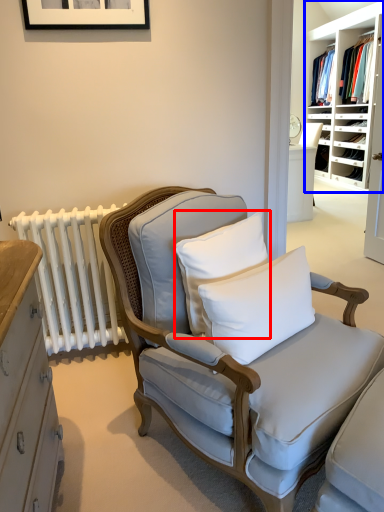
Question: Which object is closer to the camera taking this photo, pillow (highlighted by a red box) or shelf (highlighted by a blue box)?

Choices:
 (A) pillow
 (B) shelf

Answer: (A)